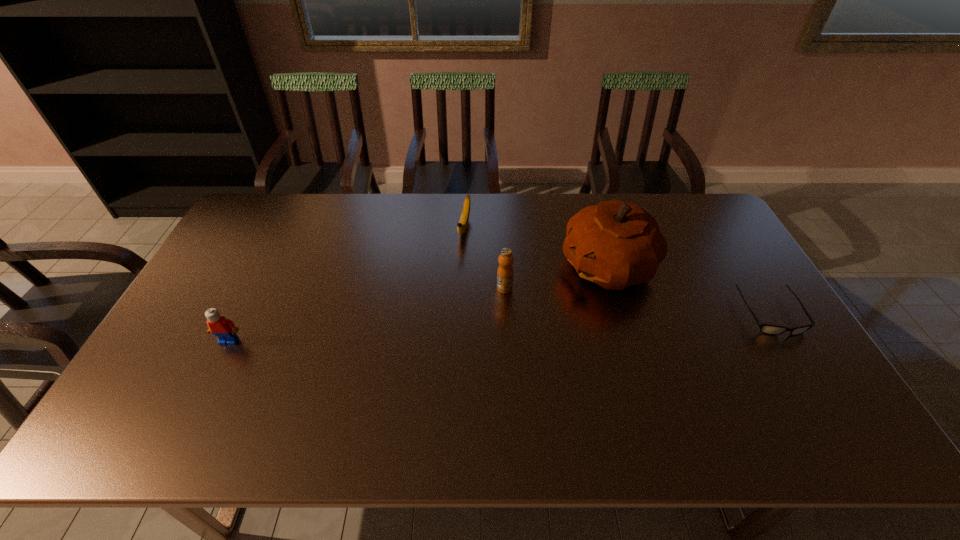
At what (x,y) coordinates should I click in order to perform the action: click on vacant point located on the front label of the second tallest object. Please return your answer as a coordinate pair (x, y). The width and height of the screenshot is (960, 540). Looking at the image, I should click on (457, 332).

Locate an element on the screen. The height and width of the screenshot is (540, 960). object located at the far edge is located at coordinates (463, 223).

Where is `object present at the left edge`? object present at the left edge is located at coordinates (224, 329).

The image size is (960, 540). Find the location of `object at the right edge`. object at the right edge is located at coordinates (768, 329).

Identify the location of free space at the far edge. The image size is (960, 540). (560, 193).

Where is `free space at the near edge of the desktop`? free space at the near edge of the desktop is located at coordinates (423, 397).

In the image, there is a desktop. At what (x,y) coordinates should I click in order to perform the action: click on blank space at the left edge. Please return your answer as a coordinate pair (x, y). This screenshot has width=960, height=540. Looking at the image, I should click on (239, 247).

Image resolution: width=960 pixels, height=540 pixels. In the image, there is a desktop. Find the location of `vacant region at the right edge`. vacant region at the right edge is located at coordinates (769, 367).

At what (x,y) coordinates should I click in order to perform the action: click on vacant region at the far right corner of the desktop. Please return your answer as a coordinate pair (x, y). Image resolution: width=960 pixels, height=540 pixels. Looking at the image, I should click on (718, 228).

Locate an element on the screen. The image size is (960, 540). vacant space in between the orange juice and the tallest object is located at coordinates (556, 278).